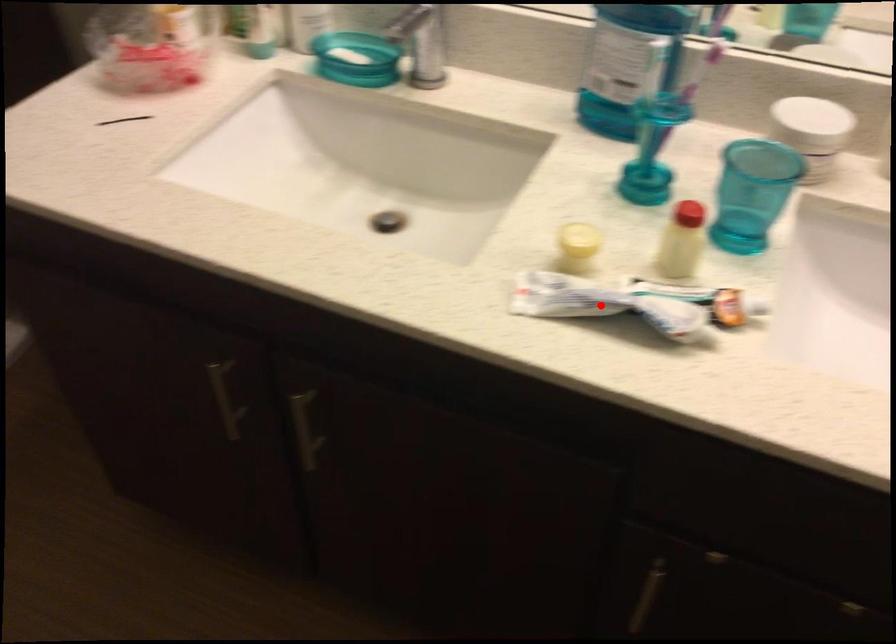
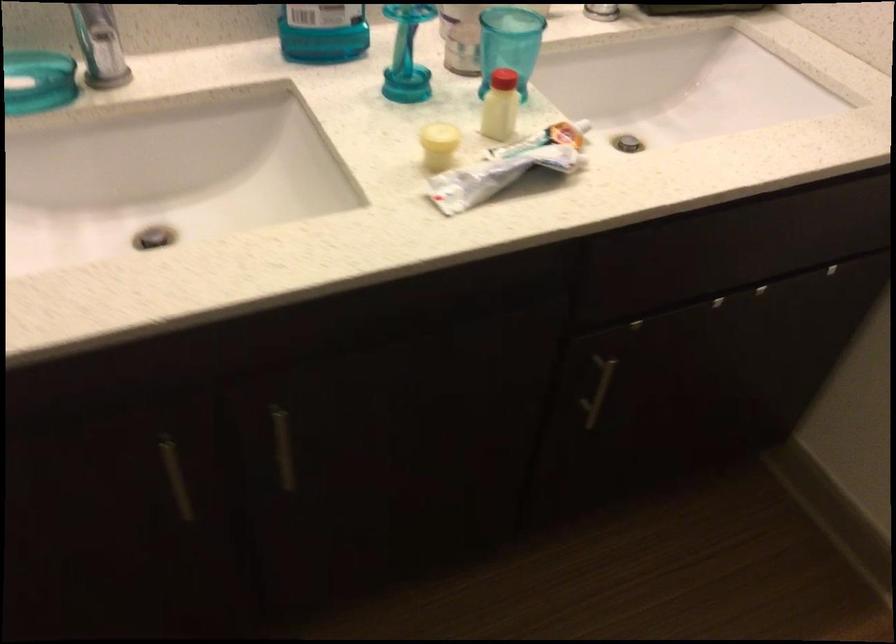
Question: I am providing you with two images of the same scene from different viewpoints. A red point is marked on the first image. Is the red point's position out of view in image 2?

Choices:
 (A) Yes
 (B) No

Answer: (B)